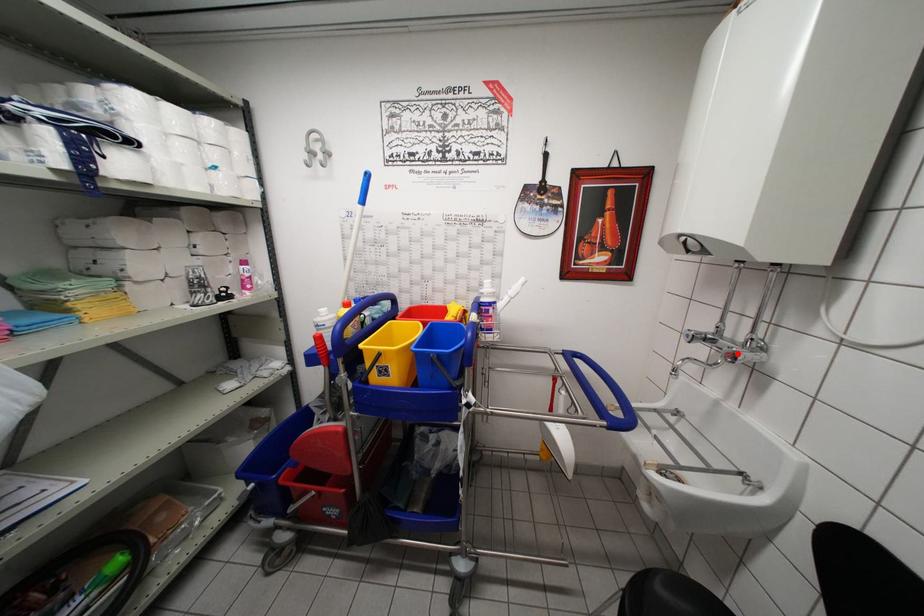
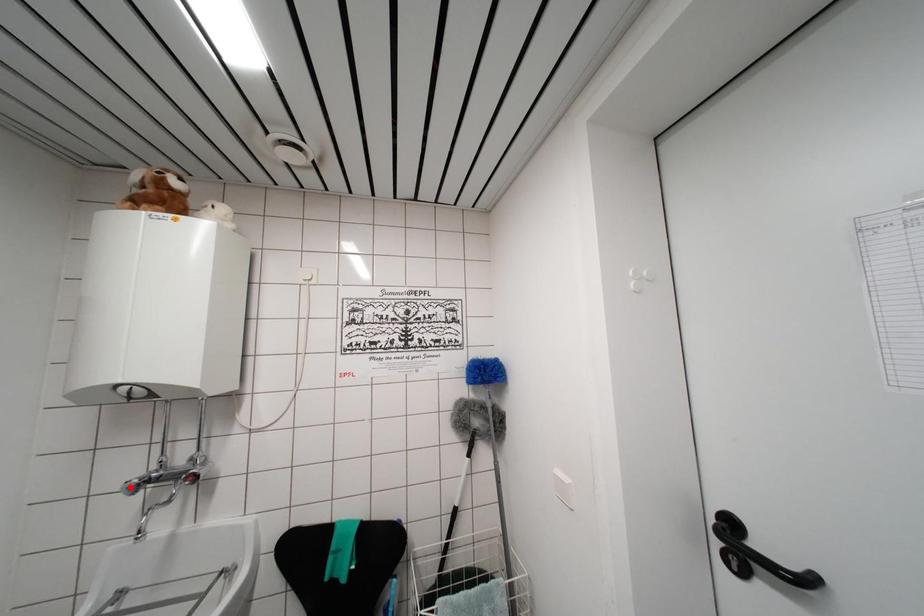
I am providing you with two images of the same scene from different viewpoints. A red point is marked on the first image and another point is marked on the second image. Do the highlighted points in image1 and image2 indicate the same real-world spot?

No